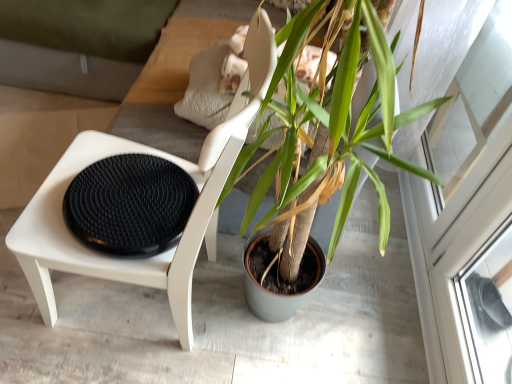
This screenshot has width=512, height=384. I want to click on vacant space underneath white matte chair at left (from a real-world perspective), so click(x=150, y=302).